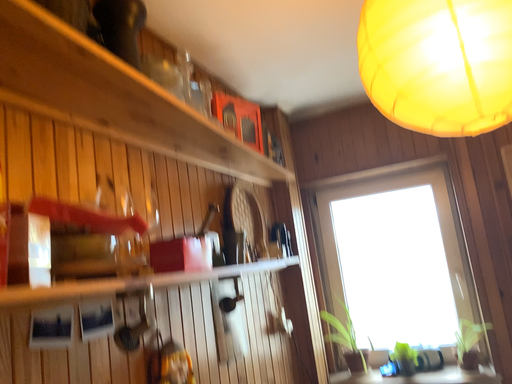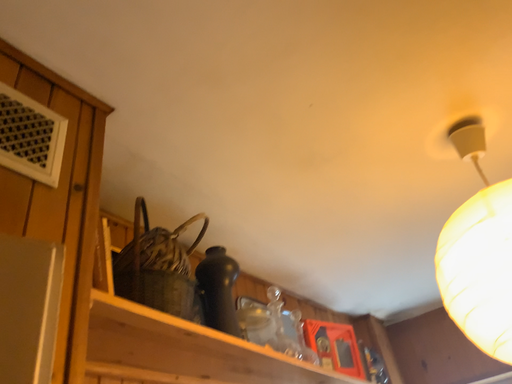
Question: How did the camera likely rotate when shooting the video?

Choices:
 (A) rotated downward
 (B) rotated upward

Answer: (B)